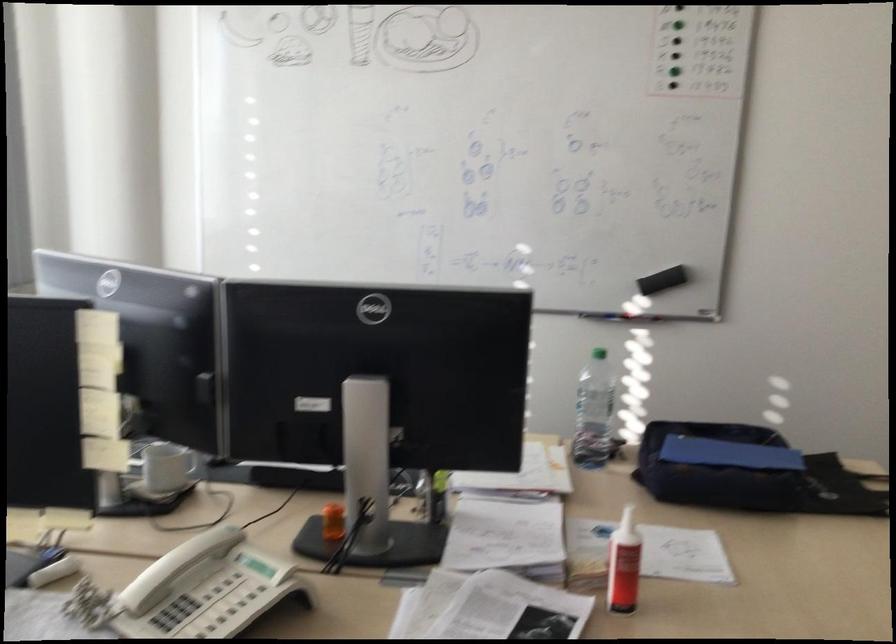
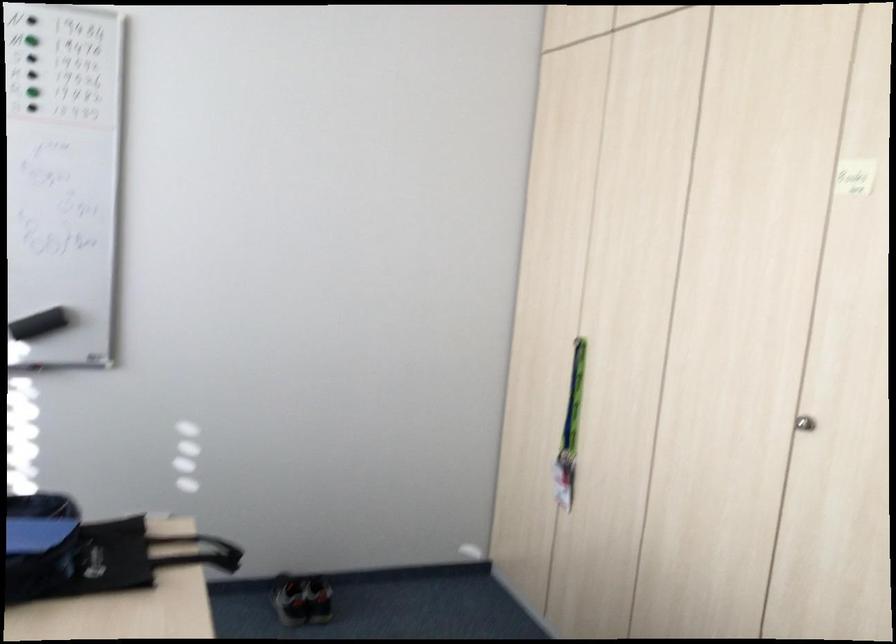
Question: How did the camera likely rotate?

Choices:
 (A) Left
 (B) Right
 (C) Up
 (D) Down

Answer: (B)